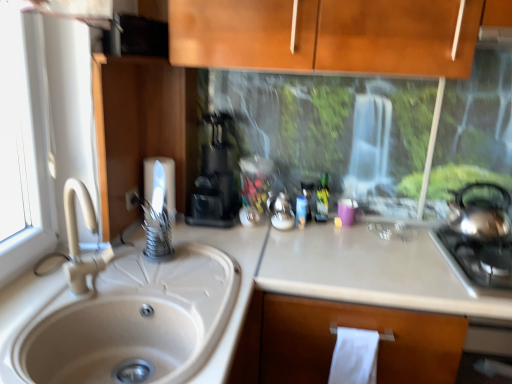
You are a GUI agent. You are given a task and a screenshot of the screen. Output one action in this format:
    pyautogui.click(x=<x>, y=<y>)
    Task: Click on the spots to the right of green matte bottle at center
    Image resolution: width=512 pixels, height=384 pixels.
    Given the screenshot: What is the action you would take?
    pyautogui.click(x=366, y=231)